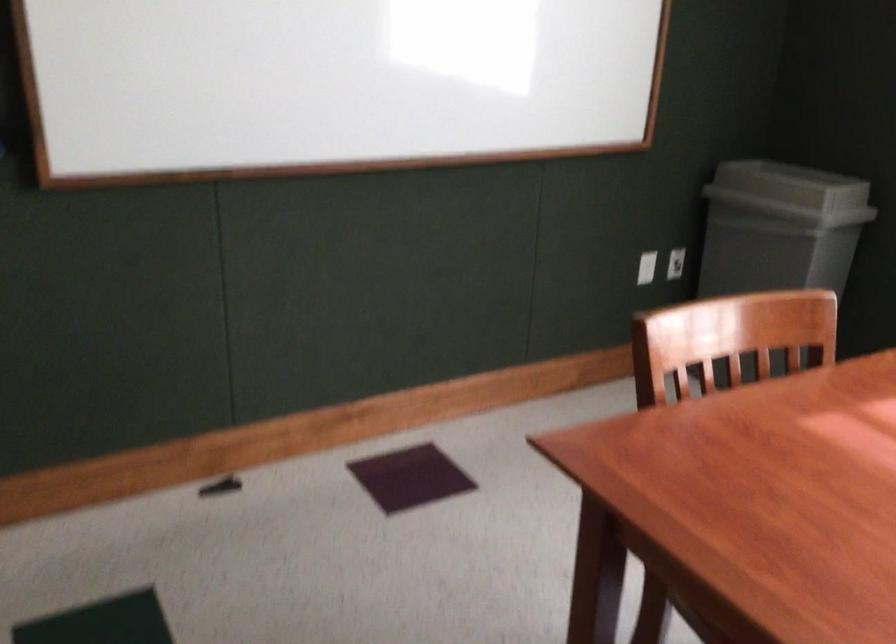
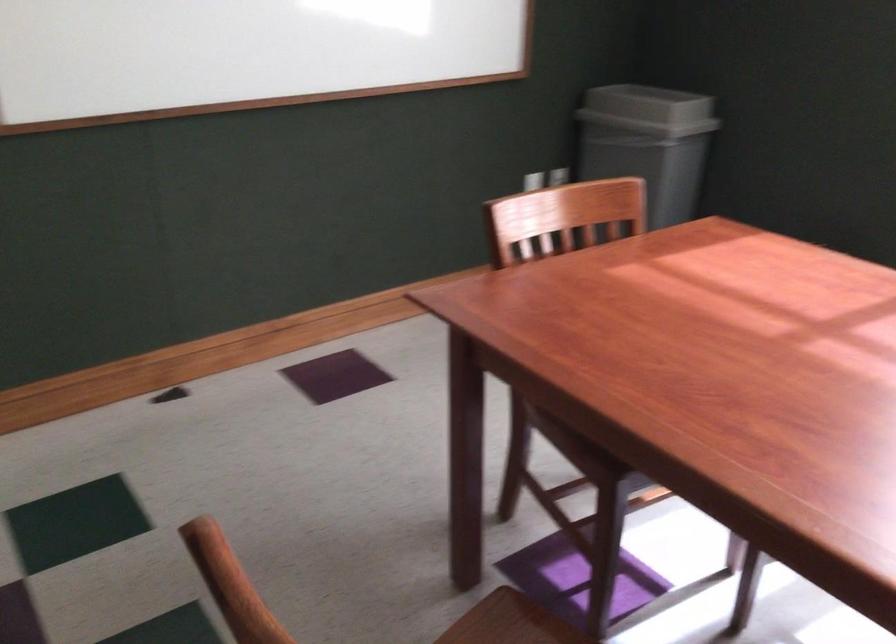
Question: Which direction would the cameraman need to move to produce the second image? Reply with the corresponding letter.

Choices:
 (A) Left
 (B) Right
 (C) Forward
 (D) Backward

Answer: (D)